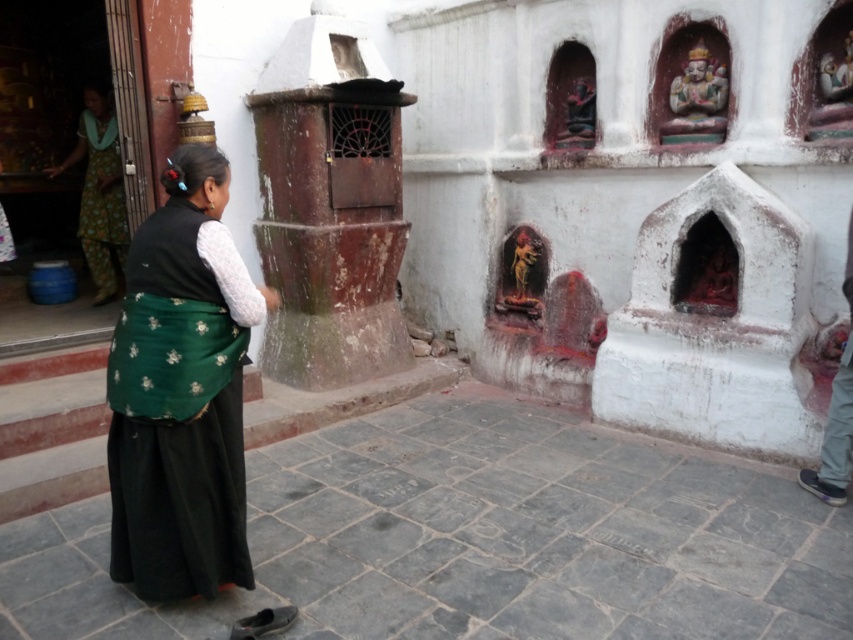
You are a visitor at the temple and want to take a photo of both the green floral fabric at center and the green floral fabric at left. Which one should you focus on first to ensure both are in the frame?

You should focus on the green floral fabric at center first since it is closer to the viewer, allowing you to adjust the camera to include both in the frame.